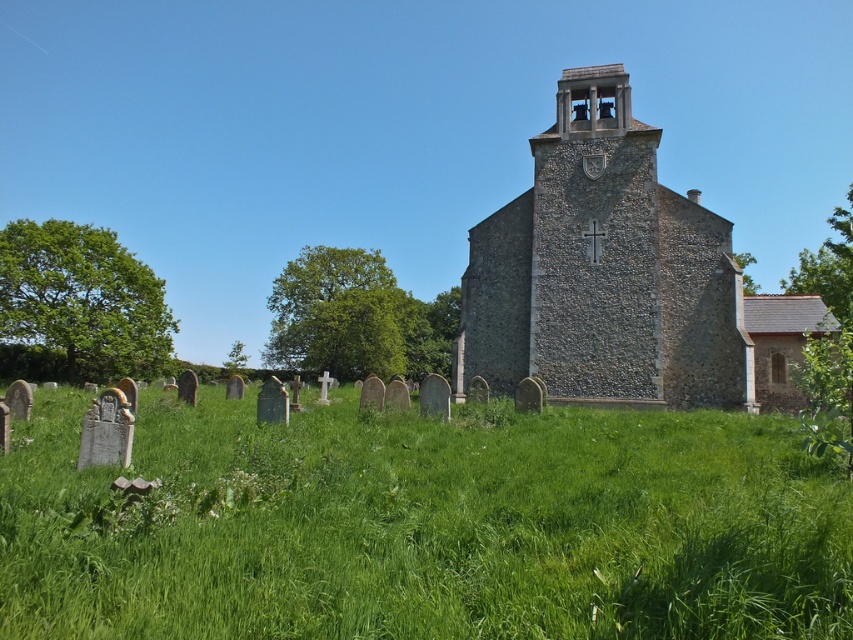
You are standing at the edge of the green grassy field at lower center and want to reach the stone church at center. Which direction should you walk to get closer to the church?

You should walk towards the stone church at center since it is located at the center of the image, and the green grassy field at lower center is positioned below it.

You are standing in the rural area and want to walk towards the stone church at center. Which direction should you walk from the green grassy field at lower center?

You should walk to the right from the green grassy field at lower center to reach the stone church at center since the grassy field is located to the left of the church.